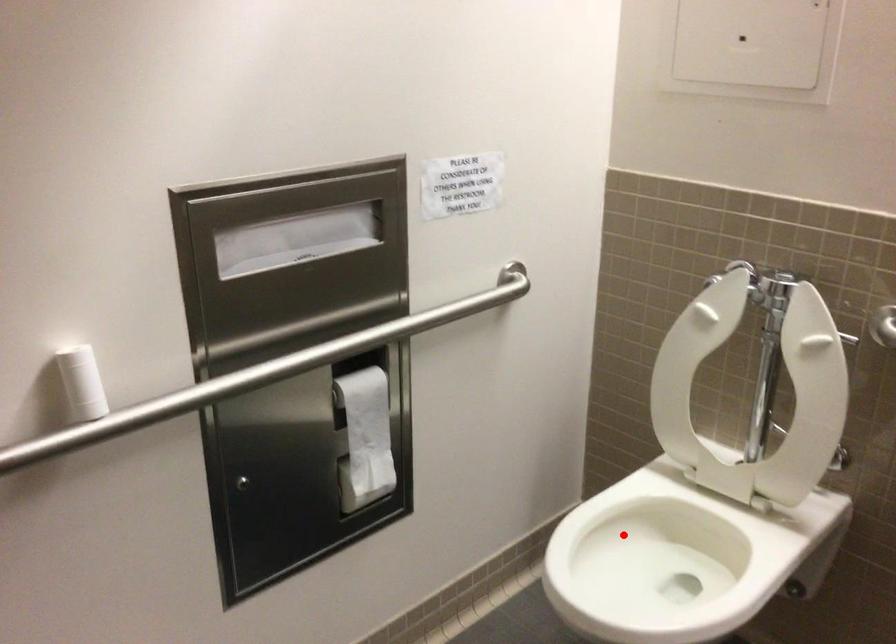
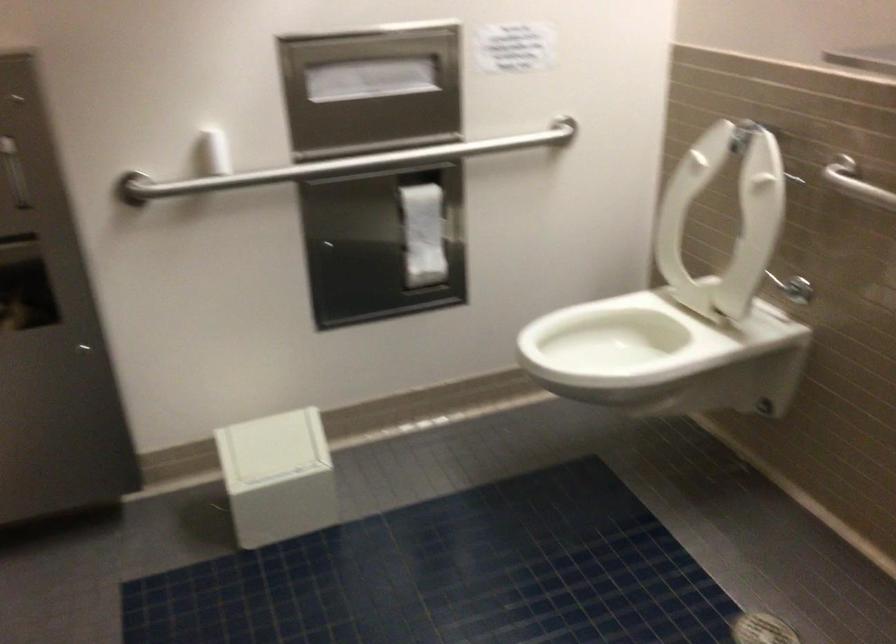
Locate, in the second image, the point that corresponds to the highlighted location in the first image.

(616, 336)